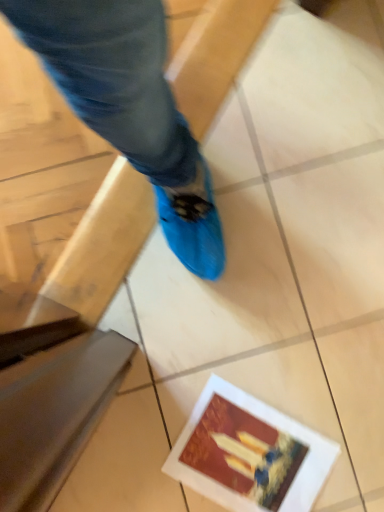
This screenshot has height=512, width=384. Identify the location of free space behind smooth beige tile at lower left. (154, 366).